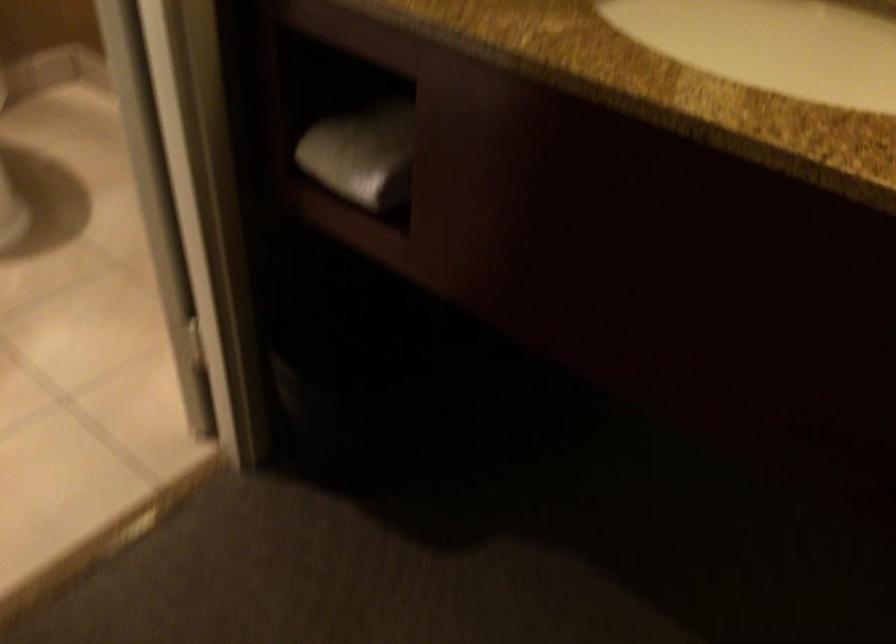
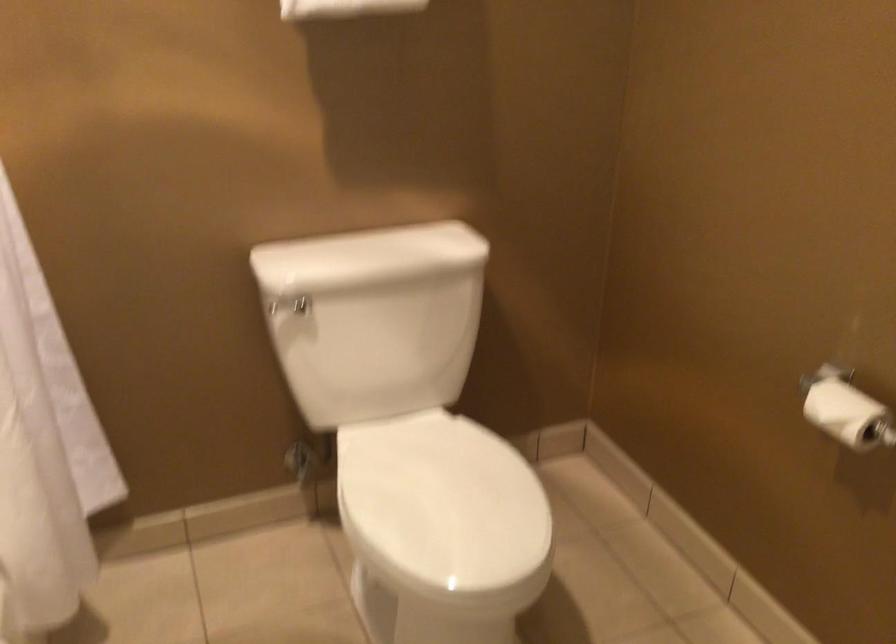
Question: The camera is either moving clockwise (left) or counter-clockwise (right) around the object. The first image is from the beginning of the video and the second image is from the end. Is the camera moving left or right when shooting the video?

Choices:
 (A) Left
 (B) Right

Answer: (B)